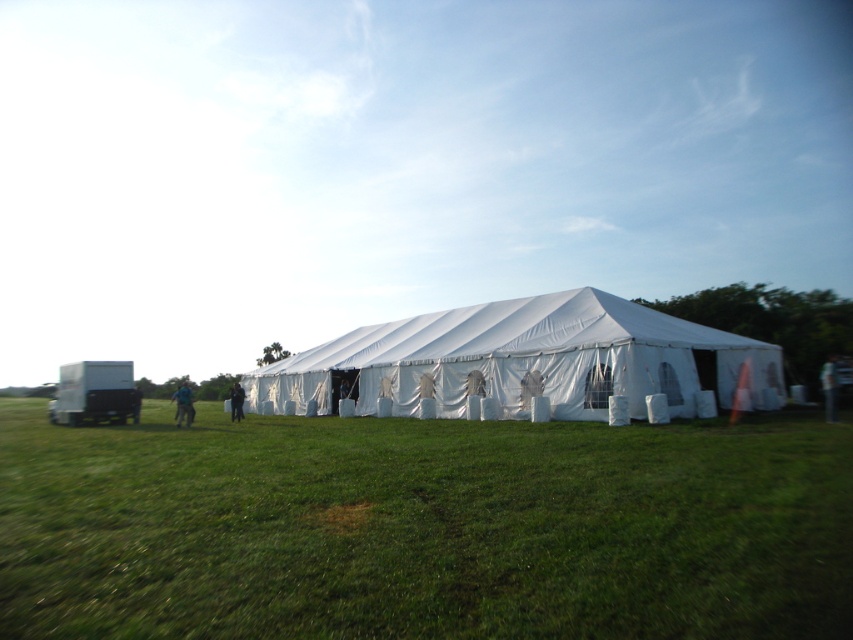
You are planning to set up a small picnic blanket in the green grass at lower center. Since the white fabric tent at center is nearby, will your picnic blanket be placed to the left or right of the tent?

The green grass at lower center is positioned on the left side of white fabric tent at center, so placing the picnic blanket there would be to the left of the tent.

You are planning to set up a picnic blanket in the open grassy field. The picnic blanket is the same size as the green grass at lower center. Will the green fabric person at right fit comfortably on the picnic blanket?

The green grass at lower center is larger in size than the green fabric person at right, so the picnic blanket, being the same size as the green grass at lower center, should be big enough to accommodate the green fabric person at right comfortably.

You are planning to set up a picnic blanket in the green grass at lower center. Considering the size of the green fabric person at right, will there be enough space to accommodate a standard picnic blanket that is 2 meters wide?

The green grass at lower center has a larger width than the green fabric person at right. Since the grass area is wider, there should be sufficient space to place a standard 2 meter wide picnic blanket there.